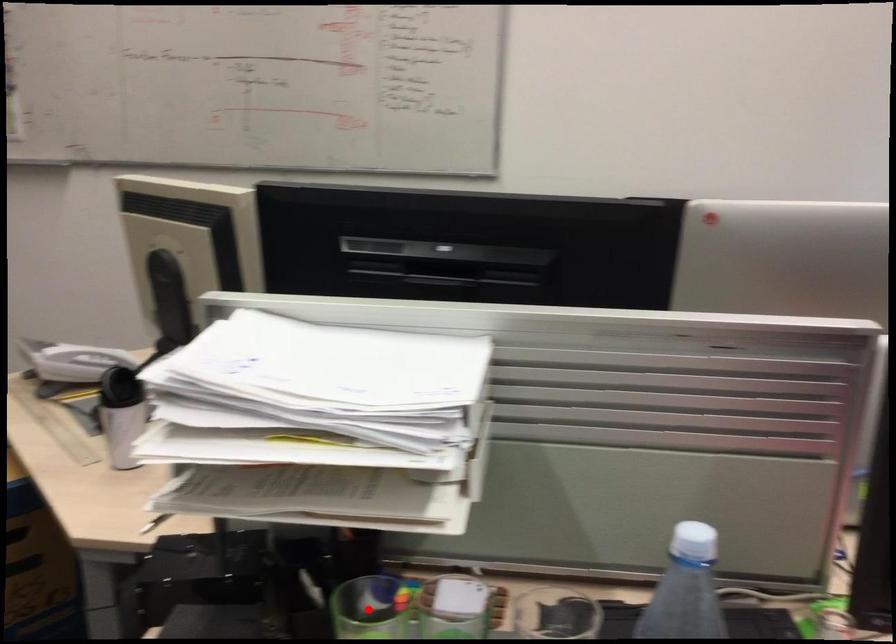
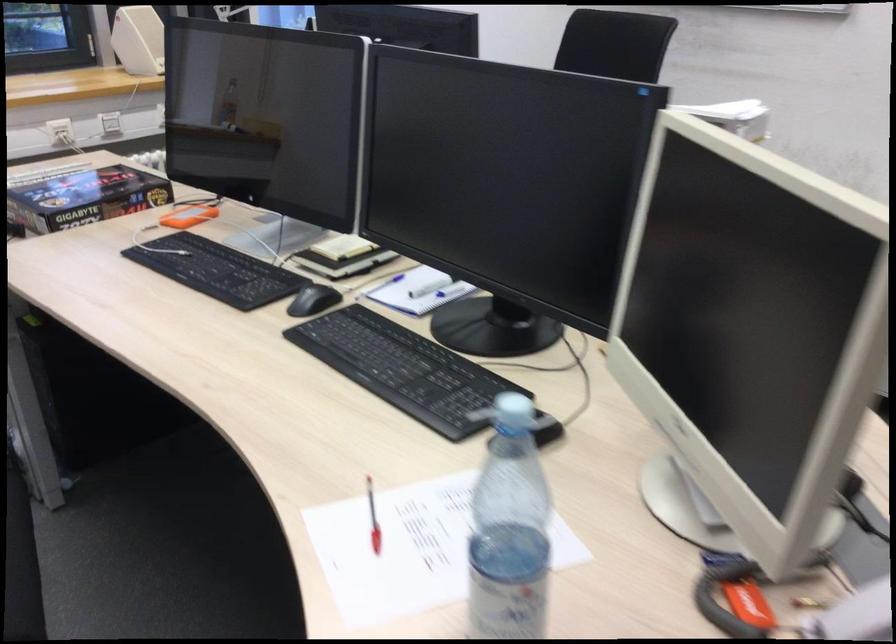
Question: I am providing you with two images of the same scene from different viewpoints. A red point is marked on the first image. At the location where the point appears in image 1, is it still visible in image 2?

Choices:
 (A) Yes
 (B) No

Answer: (B)